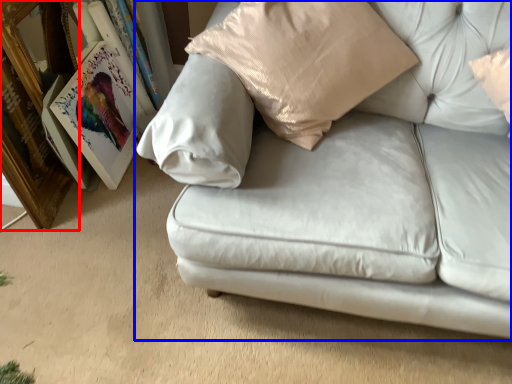
Question: Which object appears farthest to the camera in this image, picture frame (highlighted by a red box) or studio couch (highlighted by a blue box)?

Choices:
 (A) picture frame
 (B) studio couch

Answer: (A)